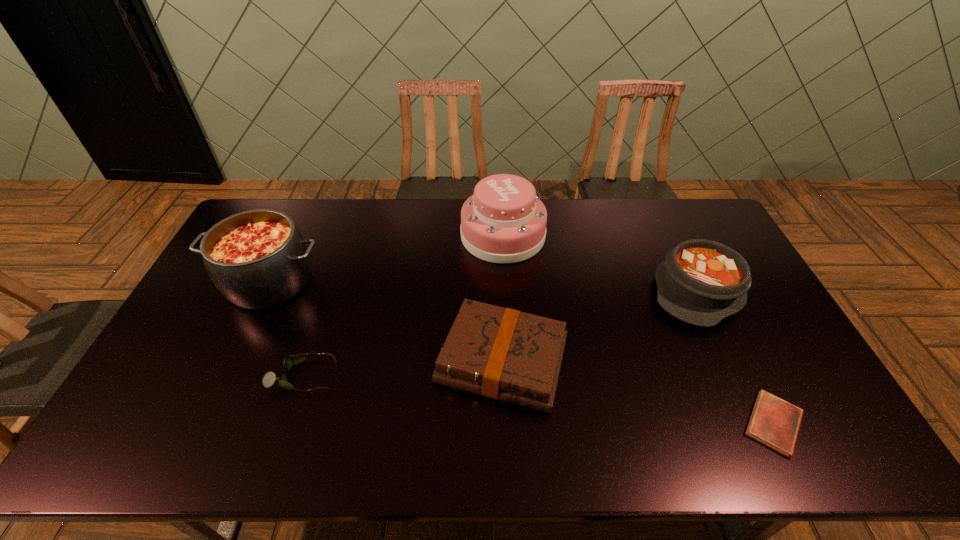
You are a GUI agent. You are given a task and a screenshot of the screen. Output one action in this format:
    pyautogui.click(x=<x>, y=<y>)
    Task: Click on the vacant region located 0.150m on the back of the hardback book
    The height and width of the screenshot is (540, 960).
    Given the screenshot: What is the action you would take?
    pyautogui.click(x=499, y=280)

Where is `vacant space located on the front-facing side of the spectacles`? This screenshot has width=960, height=540. vacant space located on the front-facing side of the spectacles is located at coordinates (364, 376).

Locate an element on the screen. Image resolution: width=960 pixels, height=540 pixels. free space located on the back of the shortest object is located at coordinates (728, 331).

This screenshot has width=960, height=540. Find the location of `object present at the far edge`. object present at the far edge is located at coordinates (504, 221).

Where is `object located in the near edge section of the desktop`? The height and width of the screenshot is (540, 960). object located in the near edge section of the desktop is located at coordinates (774, 422).

Locate an element on the screen. This screenshot has width=960, height=540. object that is at the left edge is located at coordinates (257, 259).

Where is `casserole located at the right edge`? casserole located at the right edge is located at coordinates (701, 282).

Find the location of `diary that is at the right edge`. diary that is at the right edge is located at coordinates (774, 422).

Where is `object that is at the near right corner`? object that is at the near right corner is located at coordinates (774, 422).

In the image, there is a desktop. In order to click on free space at the far edge in this screenshot , I will do `click(606, 235)`.